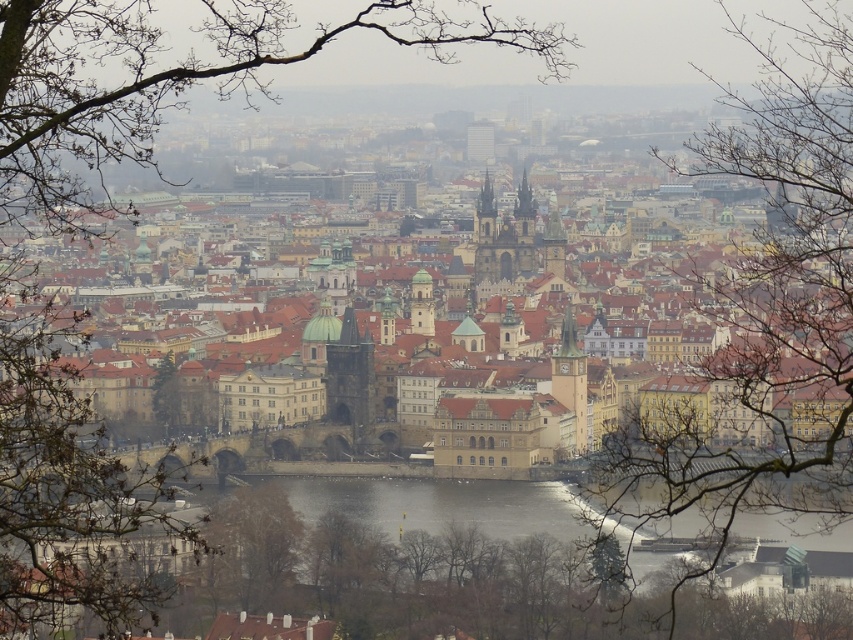
How much distance is there between bare branches at upper left and bare branches at center?

bare branches at upper left and bare branches at center are 132.38 feet apart from each other.

Is bare branches at upper left shorter than bare branches at center?

Incorrect, bare branches at upper left's height does not fall short of bare branches at center's.

I want to click on bare branches at upper left, so click(103, 234).

Does bare branches at upper left have a lesser height compared to green leafy tree at center?

Incorrect, bare branches at upper left's height does not fall short of green leafy tree at center's.

Between bare branches at upper left and green leafy tree at center, which one has more height?

bare branches at upper left is taller.

Is point (91, 45) closer to camera compared to point (158, 371)?

Yes, it is in front of point (158, 371).

Identify the location of bare branches at upper left. (103, 234).

Is smooth stone clock tower at center positioned behind brown stone clock tower at center?

No, it is in front of brown stone clock tower at center.

Which is more to the left, smooth stone clock tower at center or brown stone clock tower at center?

smooth stone clock tower at center is more to the left.

Identify the location of smooth stone clock tower at center. The width and height of the screenshot is (853, 640). (572, 378).

The image size is (853, 640). I want to click on smooth stone clock tower at center, so click(572, 378).